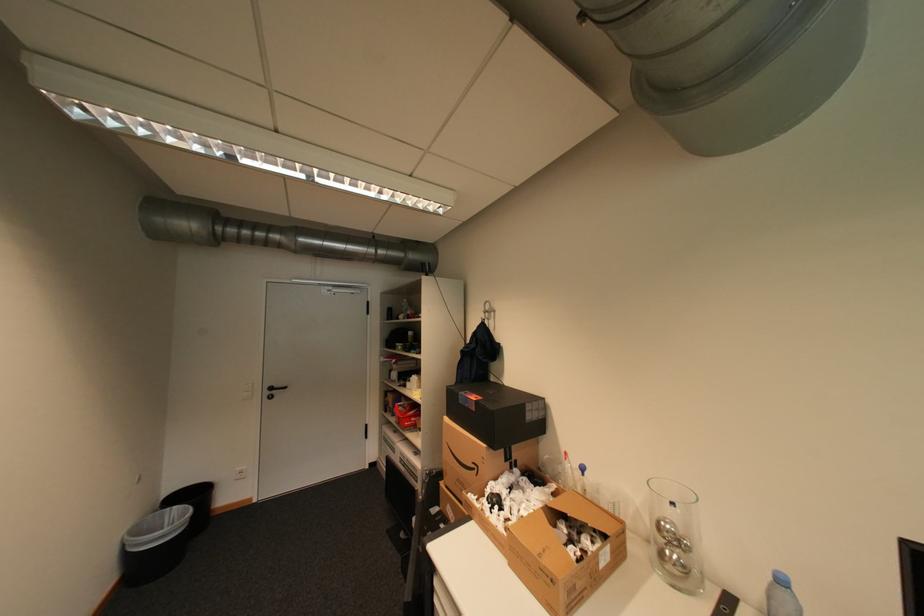
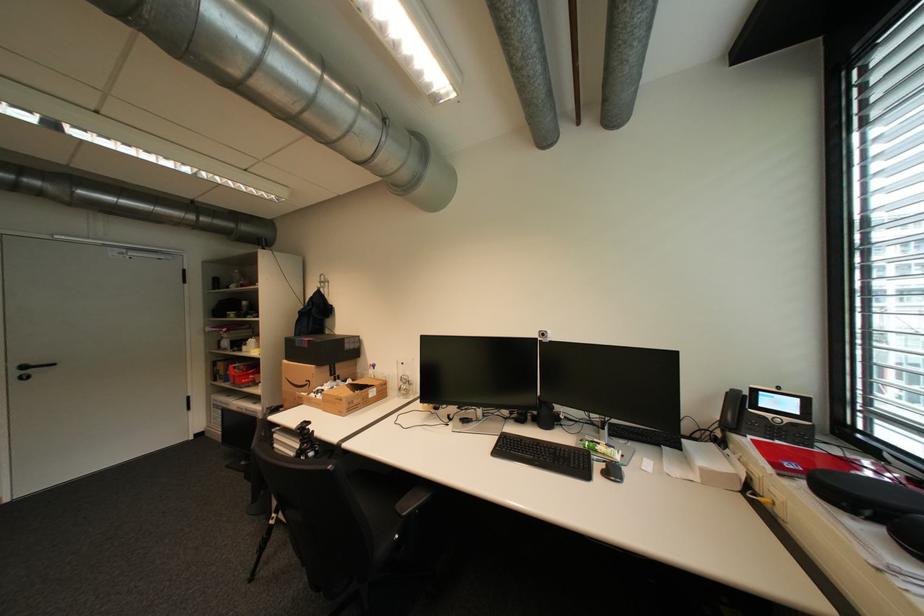
The point at (484, 468) is marked in the first image. Where is the corresponding point in the second image?

(317, 383)